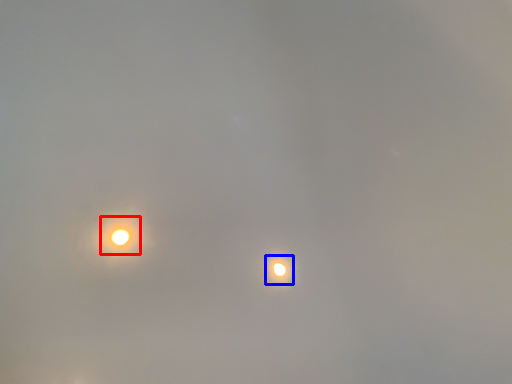
Question: Among these objects, which one is farthest to the camera, moonlight (highlighted by a red box) or moonlight (highlighted by a blue box)?

Choices:
 (A) moonlight
 (B) moonlight

Answer: (B)